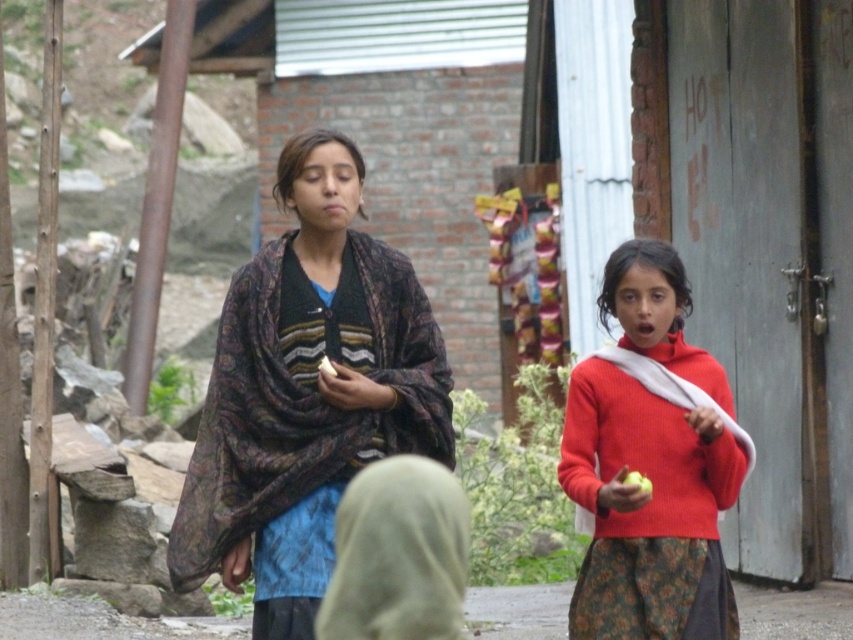
Question: Based on their relative distances, which object is farther from the matte white shawl at right?

Choices:
 (A) patterned fabric shawl at center
 (B) matte red sweater at center

Answer: (A)

Question: Can you confirm if matte red sweater at center is smaller than matte white shawl at right?

Choices:
 (A) no
 (B) yes

Answer: (A)

Question: Which of these objects is positioned farthest from the matte red sweater at center?

Choices:
 (A) matte white shawl at right
 (B) patterned fabric shawl at center

Answer: (B)

Question: Can you confirm if patterned fabric shawl at center is bigger than matte white shawl at right?

Choices:
 (A) yes
 (B) no

Answer: (A)

Question: Which point appears farthest from the camera in this image?

Choices:
 (A) (277, 321)
 (B) (693, 390)
 (C) (641, 252)

Answer: (C)

Question: Is matte red sweater at center in front of matte white shawl at right?

Choices:
 (A) no
 (B) yes

Answer: (B)